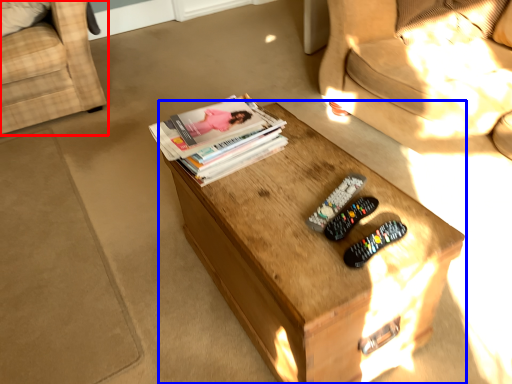
Question: Which object is further to the camera taking this photo, chair (highlighted by a red box) or table (highlighted by a blue box)?

Choices:
 (A) chair
 (B) table

Answer: (A)